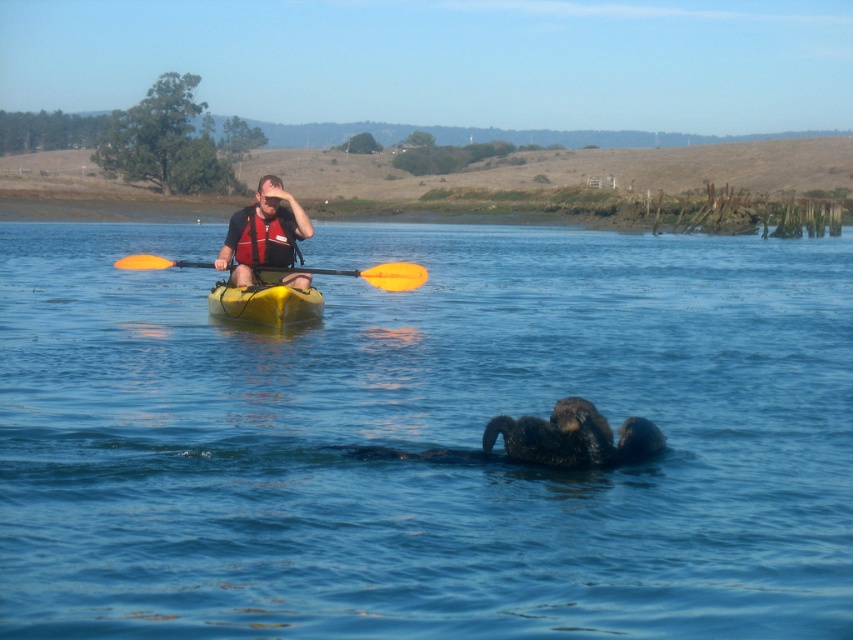
Question: Which of the following is the farthest from the observer?

Choices:
 (A) matte red life vest at center
 (B) blue water at center

Answer: (A)

Question: Is blue water at center bigger than orange plastic paddle at center?

Choices:
 (A) yes
 (B) no

Answer: (A)

Question: Can you confirm if dark brown fur at lower center is positioned above matte red life vest at center?

Choices:
 (A) yes
 (B) no

Answer: (B)

Question: Which of the following is the closest to the observer?

Choices:
 (A) (291, 312)
 (B) (289, 221)
 (C) (581, 444)
 (D) (712, 468)

Answer: (C)

Question: Is red life jacket at center to the right of orange plastic paddle at center from the viewer's perspective?

Choices:
 (A) no
 (B) yes

Answer: (B)

Question: Based on their relative distances, which object is nearer to the matte red life vest at center?

Choices:
 (A) red life jacket at center
 (B) dark brown fur at lower center
 (C) yellow matte canoe at center

Answer: (A)